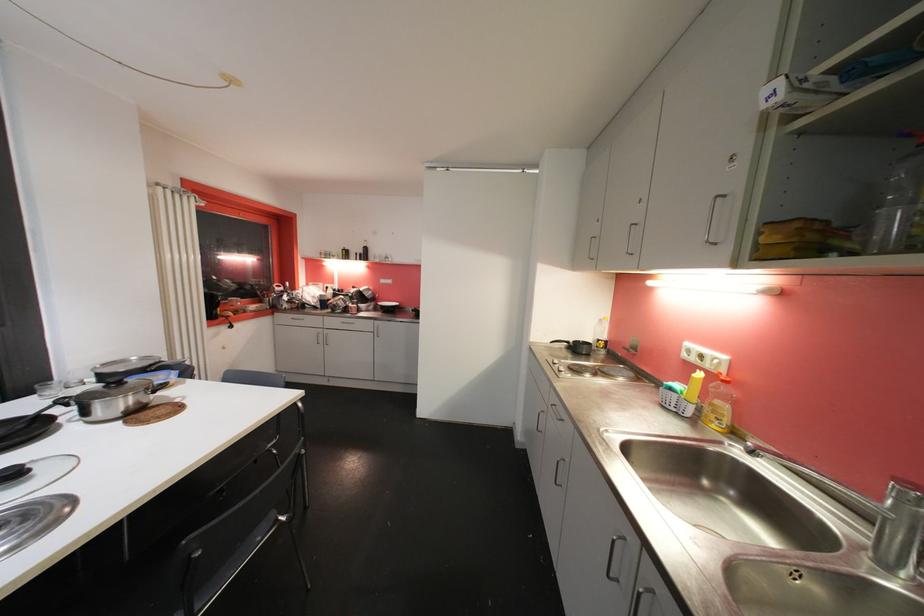
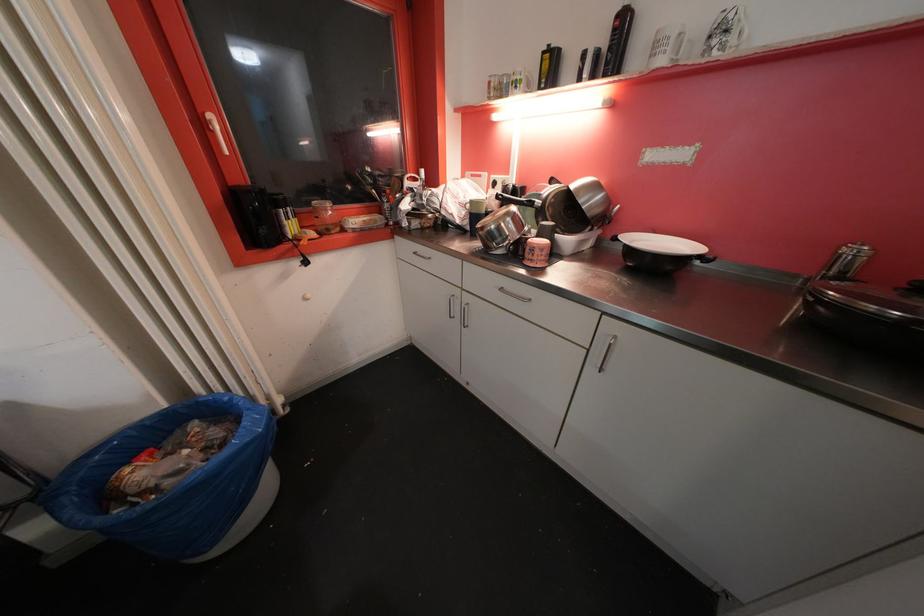
In the second image, find the point that corresponds to pixel 371 252 in the first image.

(628, 25)